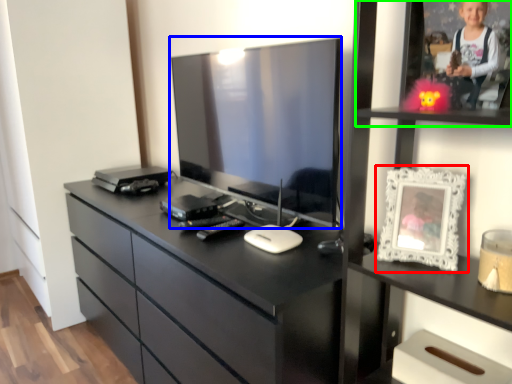
Question: Estimate the real-world distances between objects in this image. Which object is closer to picture frame (highlighted by a red box), television (highlighted by a blue box) or shelf (highlighted by a green box)?

Choices:
 (A) television
 (B) shelf

Answer: (B)